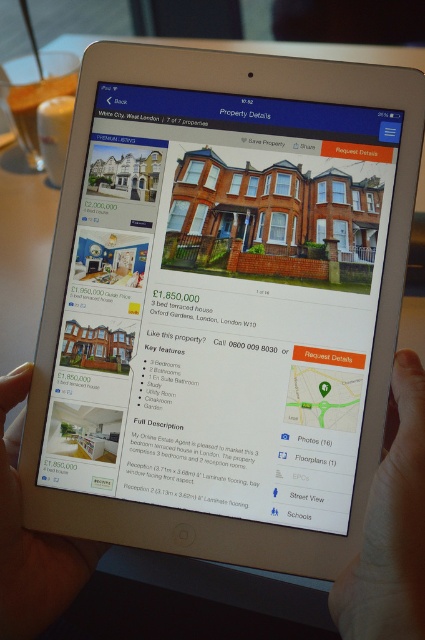
Does smooth skin hand at lower right lie in front of matte black tablet at lower left?

Yes, smooth skin hand at lower right is in front of matte black tablet at lower left.

Is smooth skin hand at lower right smaller than matte black tablet at lower left?

Incorrect, smooth skin hand at lower right is not smaller in size than matte black tablet at lower left.

Between point (380, 596) and point (31, 628), which one is positioned in front?

Point (380, 596)

The width and height of the screenshot is (425, 640). Find the location of `smooth skin hand at lower right`. smooth skin hand at lower right is located at coordinates (391, 525).